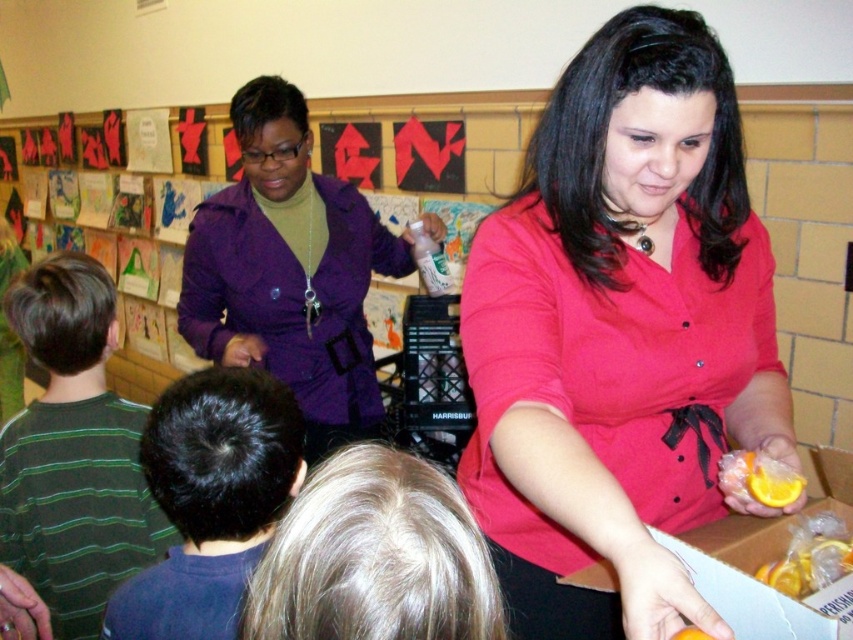
From the picture: You are a photographer trying to capture a candid shot of the scene. You notice the green striped shirt at lower left and the dark brown hair at back. Which object should you focus on if you want to capture a subject that takes up more space in the photo?

The green striped shirt at lower left is larger in size than the dark brown hair at back, so focusing on the green striped shirt at lower left will capture a subject that takes up more space in the photo.

In the classroom or community center scene, there is a person with dark brown hair at back and a translucent plastic orange at lower right. Which object has a greater width?

The dark brown hair at back has a greater width than the translucent plastic orange at lower right.